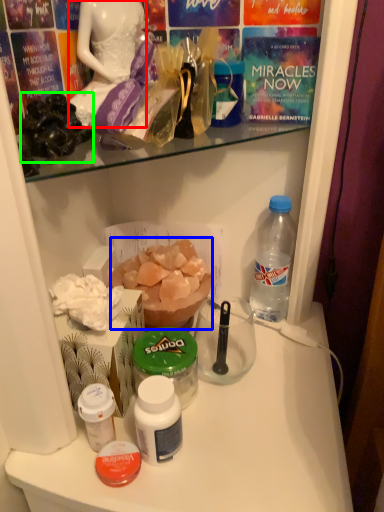
Question: Estimate the real-world distances between objects in this image. Which object is farther from fancy dress (highlighted by a red box), food (highlighted by a blue box) or stuff (highlighted by a green box)?

Choices:
 (A) food
 (B) stuff

Answer: (A)